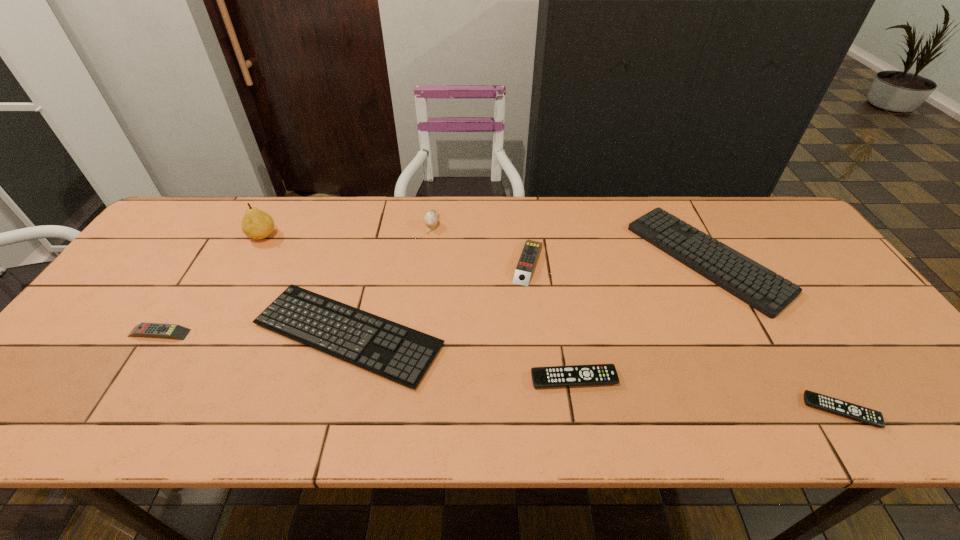
The width and height of the screenshot is (960, 540). I want to click on object that is at the far right corner, so click(x=754, y=284).

At what (x,y) coordinates should I click in order to perform the action: click on object at the near right corner. Please return your answer as a coordinate pair (x, y). The image size is (960, 540). Looking at the image, I should click on (859, 413).

Where is `vacant region at the far edge of the desktop`? vacant region at the far edge of the desktop is located at coordinates (454, 215).

Image resolution: width=960 pixels, height=540 pixels. In order to click on blank area at the near edge in this screenshot , I will do `click(358, 402)`.

Where is `vacant space at the right edge of the desktop`? vacant space at the right edge of the desktop is located at coordinates (888, 381).

Where is `vacant area at the near left corner`? This screenshot has width=960, height=540. vacant area at the near left corner is located at coordinates click(46, 410).

Where is `empty space that is in between the farthest remote control and the escargot`? The height and width of the screenshot is (540, 960). empty space that is in between the farthest remote control and the escargot is located at coordinates (480, 242).

This screenshot has width=960, height=540. Find the location of `vacant area that lies between the shorter computer keyboard and the farther yellow remote control`. vacant area that lies between the shorter computer keyboard and the farther yellow remote control is located at coordinates (438, 298).

At what (x,y) coordinates should I click in order to perform the action: click on free spot between the black computer keyboard and the taller computer keyboard. Please return your answer as a coordinate pair (x, y). Looking at the image, I should click on (527, 296).

I want to click on unoccupied position between the second nearest remote control and the tallest remote control, so click(x=551, y=320).